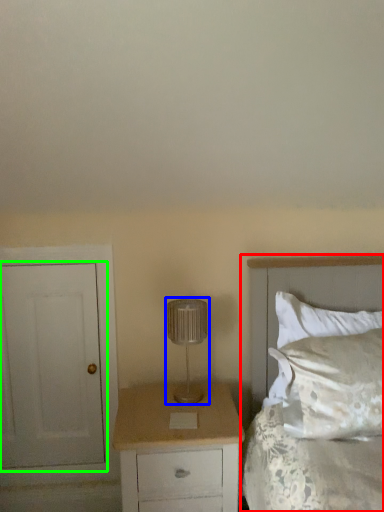
Question: Estimate the real-world distances between objects in this image. Which object is closer to bed (highlighted by a red box), lamp (highlighted by a blue box) or door (highlighted by a green box)?

Choices:
 (A) lamp
 (B) door

Answer: (A)